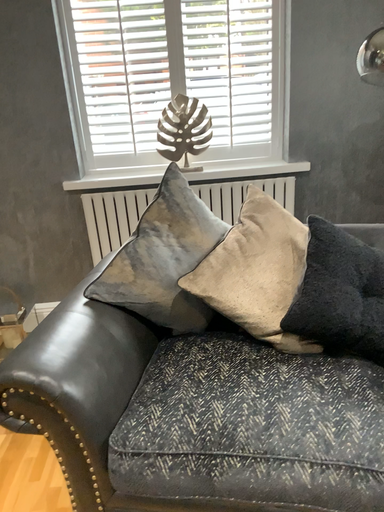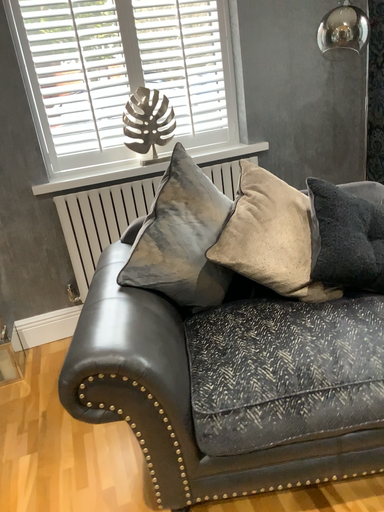
Question: Which way did the camera rotate in the video?

Choices:
 (A) rotated right
 (B) rotated left

Answer: (A)